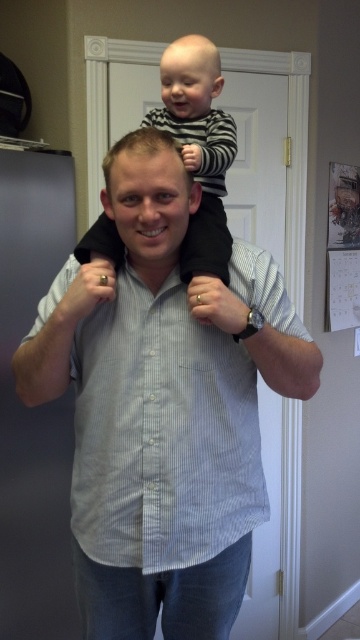
You are a tailor trying to decide which shirt to place on the top shelf of your display. The top shelf is only 1 meter in height. Given the light blue striped shirt at center and the striped cotton shirt at upper center, which one can be placed on the top shelf without bending?

The striped cotton shirt at upper center can be placed on the top shelf without bending because it is shorter than the light blue striped shirt at center, and the shelf height is 1 meter.

You are standing in the kitchen and see the point marked at coordinates (162,433). What object is located at that point?

The point at coordinates (162,433) marks the location of the light blue striped shirt at center.

You are standing in the kitchen and want to reach the point at coordinates [219,461]. If your arm can extend 1 meter, can you reach that point?

The point at coordinates [219,461] is 1.18 meters away from the camera, so your arm cannot reach it since it can only extend 1 meter.